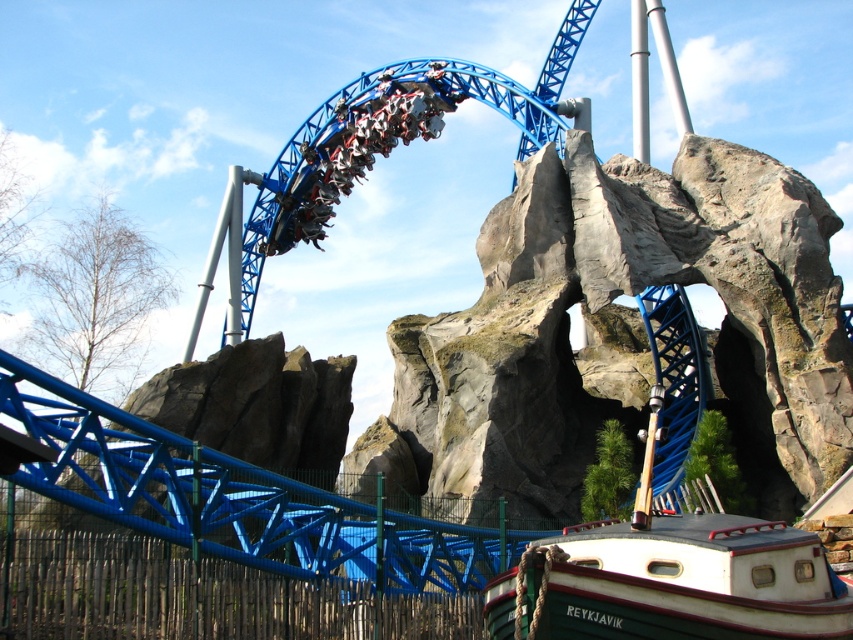
Question: Considering the relative positions of white matte boat at lower right and shiny blue roller coaster at upper center in the image provided, where is white matte boat at lower right located with respect to shiny blue roller coaster at upper center?

Choices:
 (A) left
 (B) right

Answer: (B)

Question: Is white matte boat at lower right closer to the viewer compared to shiny blue roller coaster at upper center?

Choices:
 (A) yes
 (B) no

Answer: (A)

Question: Estimate the real-world distances between objects in this image. Which object is farther from the rough stone rock at center?

Choices:
 (A) white matte boat at lower right
 (B) shiny blue roller coaster at upper center

Answer: (B)

Question: Which point is closer to the camera?

Choices:
 (A) (613, 605)
 (B) (381, 104)
 (C) (729, 188)

Answer: (A)

Question: Is rough stone rock at center thinner than white matte boat at lower right?

Choices:
 (A) no
 (B) yes

Answer: (A)

Question: Which point is closer to the camera?

Choices:
 (A) (817, 234)
 (B) (735, 620)

Answer: (B)